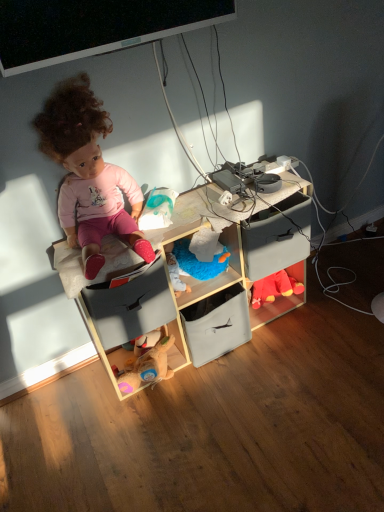
I want to click on vacant space to the right of velvet red plush toy at lower right, the first toy in the right-to-left sequence, so click(319, 291).